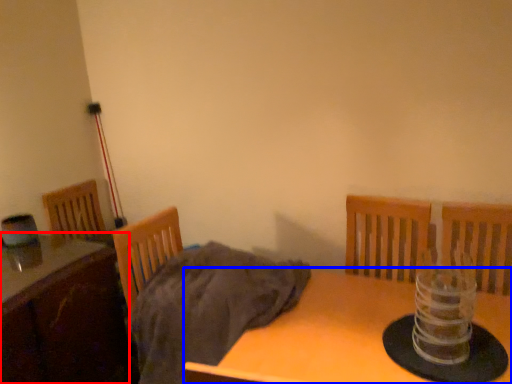
Question: Among these objects, which one is farthest to the camera, table (highlighted by a red box) or table (highlighted by a blue box)?

Choices:
 (A) table
 (B) table

Answer: (A)